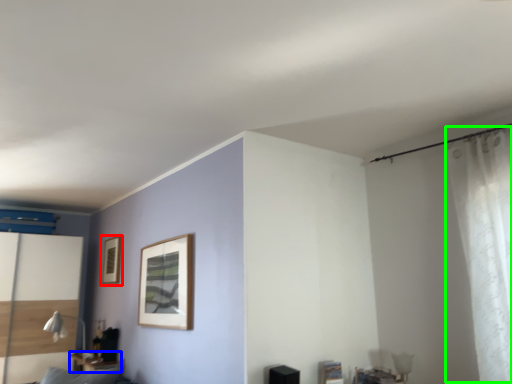
Question: Estimate the real-world distances between objects in this image. Which object is closer to picture frame (highlighted by a red box), table (highlighted by a blue box) or curtain (highlighted by a green box)?

Choices:
 (A) table
 (B) curtain

Answer: (A)